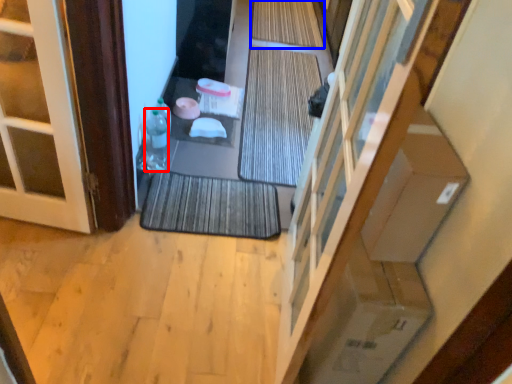
Question: Which of the following is the closest to the observer, bottle (highlighted by a red box) or bath mat (highlighted by a blue box)?

Choices:
 (A) bottle
 (B) bath mat

Answer: (A)